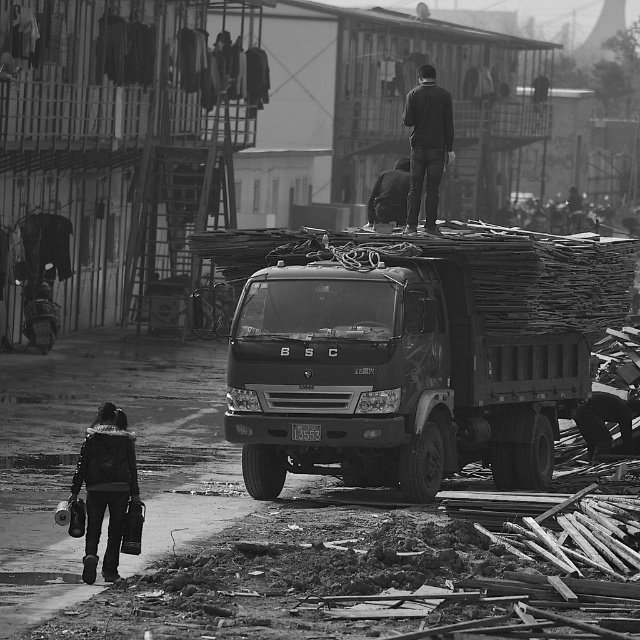
Question: Is black fuzzy jacket at lower left positioned at the back of dark fabric jacket at upper center?

Choices:
 (A) no
 (B) yes

Answer: (A)

Question: Which of the following is the farthest from the observer?

Choices:
 (A) (388, 218)
 (B) (413, 134)
 (C) (260, 374)
 (D) (120, 524)

Answer: (A)

Question: Does dark gray metallic truck at center appear on the right side of dark fabric jacket at upper center?

Choices:
 (A) no
 (B) yes

Answer: (A)

Question: Can you confirm if dark gray metallic truck at center is positioned below dark fabric jacket at upper center?

Choices:
 (A) yes
 (B) no

Answer: (A)

Question: Which point appears farthest from the camera in this image?

Choices:
 (A) (116, 490)
 (B) (422, 132)
 (C) (374, 221)
 (D) (579, 397)

Answer: (C)

Question: Which of the following is the closest to the observer?

Choices:
 (A) (120, 426)
 (B) (429, 102)
 (C) (444, 435)
 (D) (385, 170)

Answer: (A)